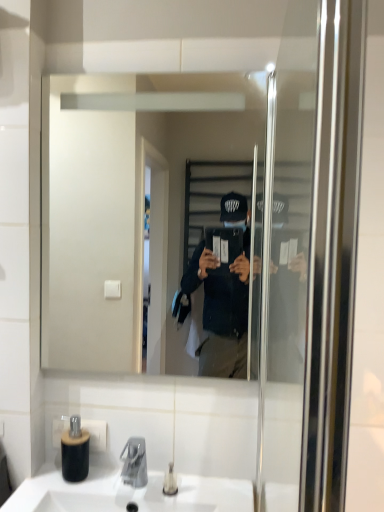
Question: Can you confirm if black matte bottle at lower left is shorter than clear glass mirror at center?

Choices:
 (A) yes
 (B) no

Answer: (A)

Question: Could you tell me if black matte bottle at lower left is turned towards clear glass mirror at center?

Choices:
 (A) yes
 (B) no

Answer: (B)

Question: Is clear glass mirror at center completely or partially inside black matte bottle at lower left?

Choices:
 (A) no
 (B) yes

Answer: (A)

Question: From a real-world perspective, is black matte bottle at lower left on clear glass mirror at center?

Choices:
 (A) no
 (B) yes

Answer: (A)

Question: Is black matte bottle at lower left turned away from clear glass mirror at center?

Choices:
 (A) yes
 (B) no

Answer: (B)

Question: Which is correct: white ceramic sink at lower center is inside black matte bottle at lower left, or outside of it?

Choices:
 (A) inside
 (B) outside

Answer: (B)

Question: From their relative heights in the image, would you say white ceramic sink at lower center is taller or shorter than black matte bottle at lower left?

Choices:
 (A) tall
 (B) short

Answer: (B)

Question: Is point (44, 508) closer or farther from the camera than point (82, 463)?

Choices:
 (A) closer
 (B) farther

Answer: (A)

Question: Is white ceramic sink at lower center in front of or behind black matte bottle at lower left in the image?

Choices:
 (A) front
 (B) behind

Answer: (A)

Question: From the image's perspective, is black matte bottle at lower left positioned above or below clear glass mirror at center?

Choices:
 (A) above
 (B) below

Answer: (B)

Question: Is black matte bottle at lower left in front of or behind clear glass mirror at center in the image?

Choices:
 (A) behind
 (B) front

Answer: (A)

Question: Considering the positions of black matte bottle at lower left and clear glass mirror at center in the image, is black matte bottle at lower left wider or thinner than clear glass mirror at center?

Choices:
 (A) thin
 (B) wide

Answer: (B)

Question: In the image, is black matte bottle at lower left on the left side or the right side of clear glass mirror at center?

Choices:
 (A) left
 (B) right

Answer: (A)

Question: In terms of height, does black matte bottle at lower left look taller or shorter compared to white ceramic sink at lower center?

Choices:
 (A) short
 (B) tall

Answer: (B)

Question: Looking at their shapes, would you say black matte bottle at lower left is wider or thinner than white ceramic sink at lower center?

Choices:
 (A) wide
 (B) thin

Answer: (B)